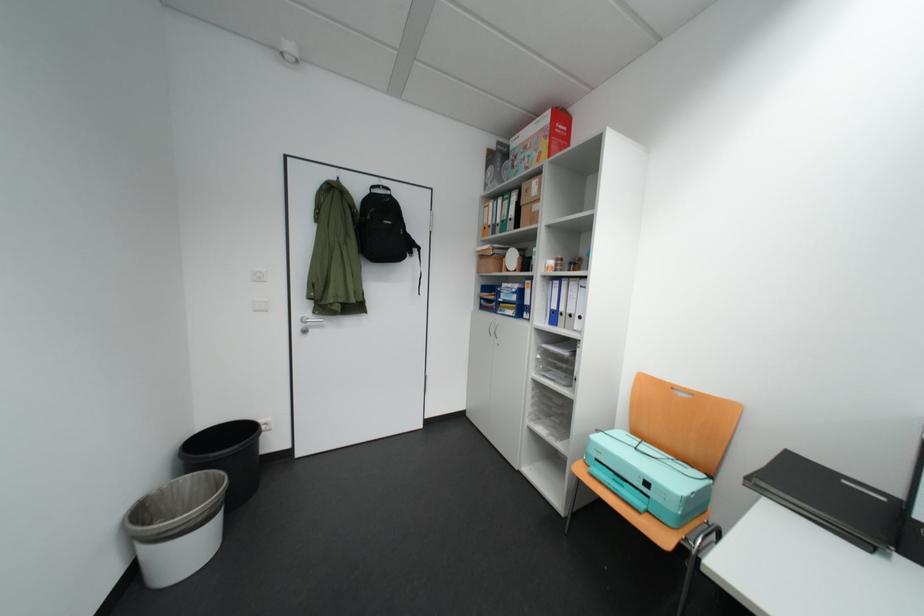
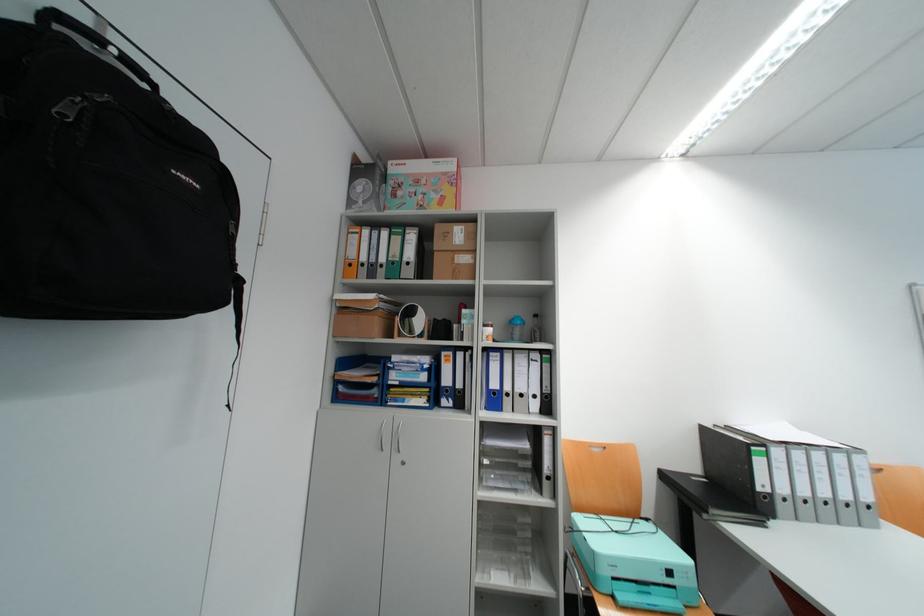
In the second image, find the point that corresponds to (659,485) in the first image.

(682, 573)